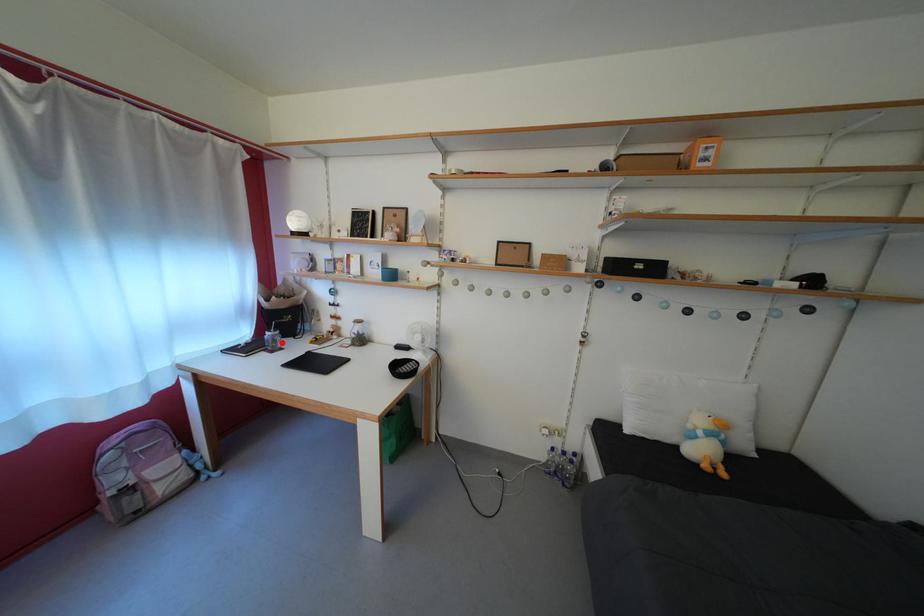
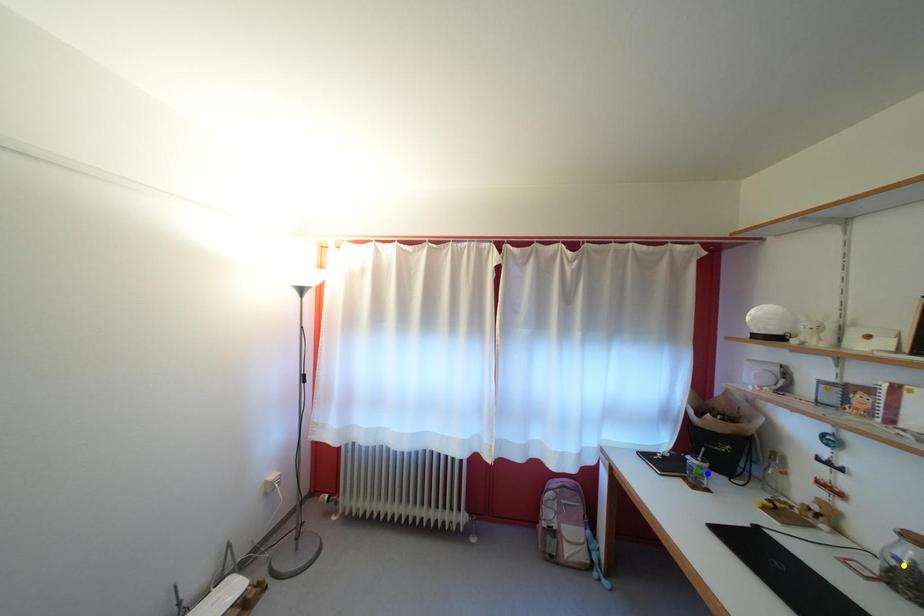
Question: I am providing you with two images of the same scene from different viewpoints. A red point is marked on the first image. You are given multiple points on the second image. Which point in image 2 is actually the same real-world point as the red point in image 1?

Choices:
 (A) yellow point
 (B) green point
 (C) blue point

Answer: (C)